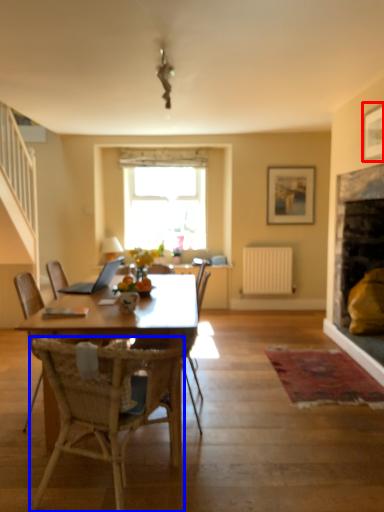
Question: Which object appears farthest to the camera in this image, picture frame (highlighted by a red box) or chair (highlighted by a blue box)?

Choices:
 (A) picture frame
 (B) chair

Answer: (A)